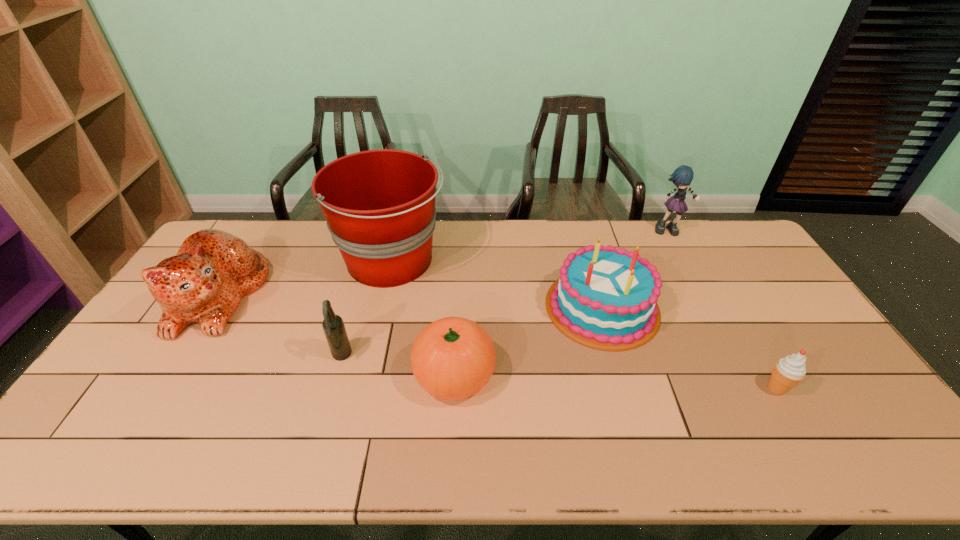
This screenshot has width=960, height=540. Find the location of `free space at the near edge of the desktop`. free space at the near edge of the desktop is located at coordinates (413, 463).

Find the location of `vacant space at the left edge of the desktop`. vacant space at the left edge of the desktop is located at coordinates (170, 363).

Find the location of `free space at the right edge`. free space at the right edge is located at coordinates (811, 329).

I want to click on vacant region at the near left corner of the desktop, so click(115, 439).

Where is `vacant area that lies between the pumpkin and the fifth object from left to right`? The image size is (960, 540). vacant area that lies between the pumpkin and the fifth object from left to right is located at coordinates (528, 341).

Identify the location of vacant area between the cat and the birthday cake. (410, 301).

Identify the location of unoccupied area between the tallest object and the third object from right to left. (497, 284).

The image size is (960, 540). What are the coordinates of `empty location between the shortest object and the pumpkin` in the screenshot? It's located at (615, 381).

The height and width of the screenshot is (540, 960). What are the coordinates of `free spot between the icecream and the pumpkin` in the screenshot? It's located at (615, 381).

Find the location of a particular element. vacant space that's between the beer bottle and the shortest object is located at coordinates (559, 373).